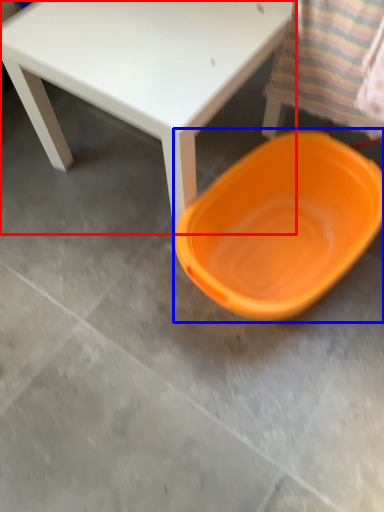
Question: Which object appears closest to the camera in this image, table (highlighted by a red box) or plate (highlighted by a blue box)?

Choices:
 (A) table
 (B) plate

Answer: (A)